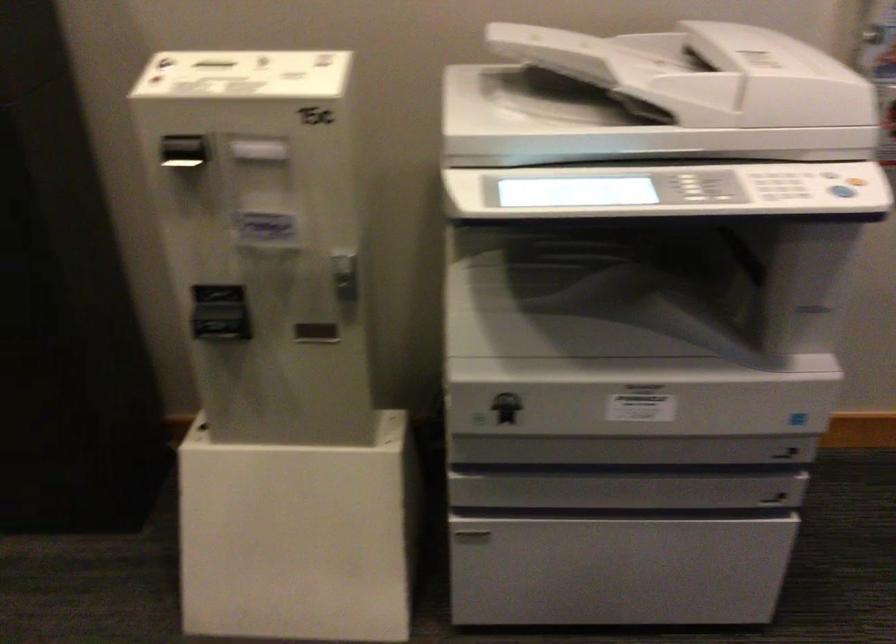
Identify the location of orange power button. This screenshot has width=896, height=644. (855, 181).